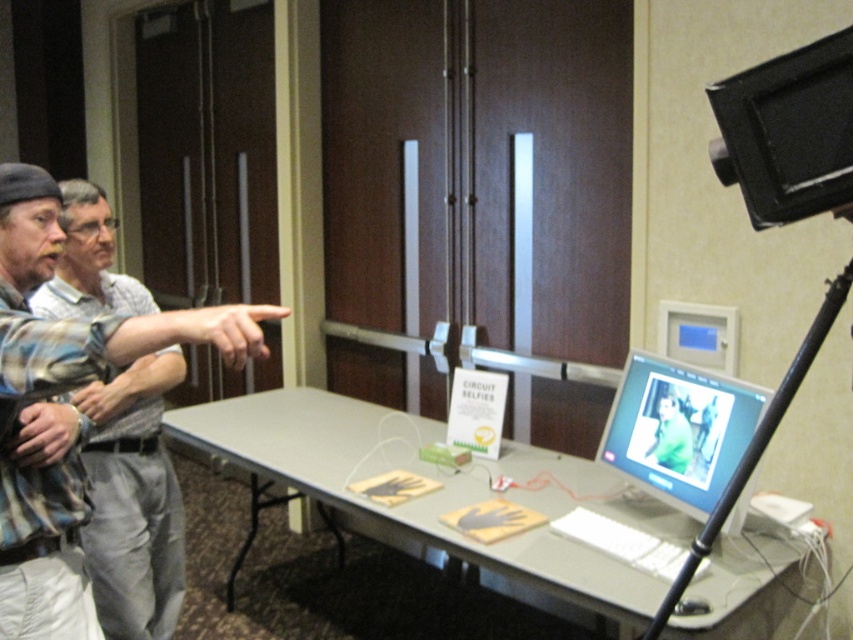
The height and width of the screenshot is (640, 853). Describe the element at coordinates (788, 132) in the screenshot. I see `black plastic video camera at upper right` at that location.

Which is more to the left, black plastic video camera at upper right or black metal tripod at right?

From the viewer's perspective, black plastic video camera at upper right appears more on the left side.

I want to click on black plastic video camera at upper right, so click(x=788, y=132).

Where is `black plastic video camera at upper right`? black plastic video camera at upper right is located at coordinates (788, 132).

Which is above, plaid shirt at left or black plastic video camera at upper right?

Positioned higher is black plastic video camera at upper right.

Is plaid shirt at left in front of black plastic video camera at upper right?

No.

Does point (112, 396) lie behind point (729, 172)?

Yes, point (112, 396) is behind point (729, 172).

This screenshot has height=640, width=853. I want to click on plaid shirt at left, so click(x=132, y=500).

Is gray plastic table at center in front of plaid shirt at left?

Yes.

Does point (601, 504) come farther from viewer compared to point (125, 600)?

That is True.

Where is `gray plastic table at center`? gray plastic table at center is located at coordinates (437, 490).